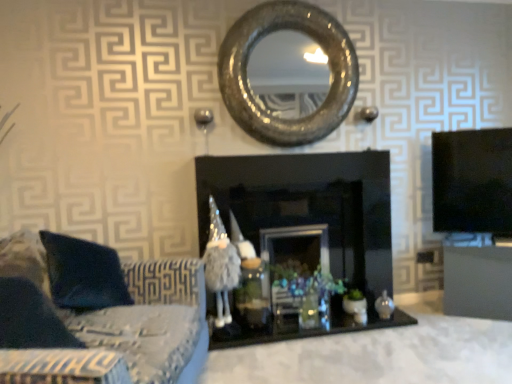
Identify the location of free space that is in between matte black cabinet at right and black glossy fireplace at center. Image resolution: width=512 pixels, height=384 pixels. (419, 323).